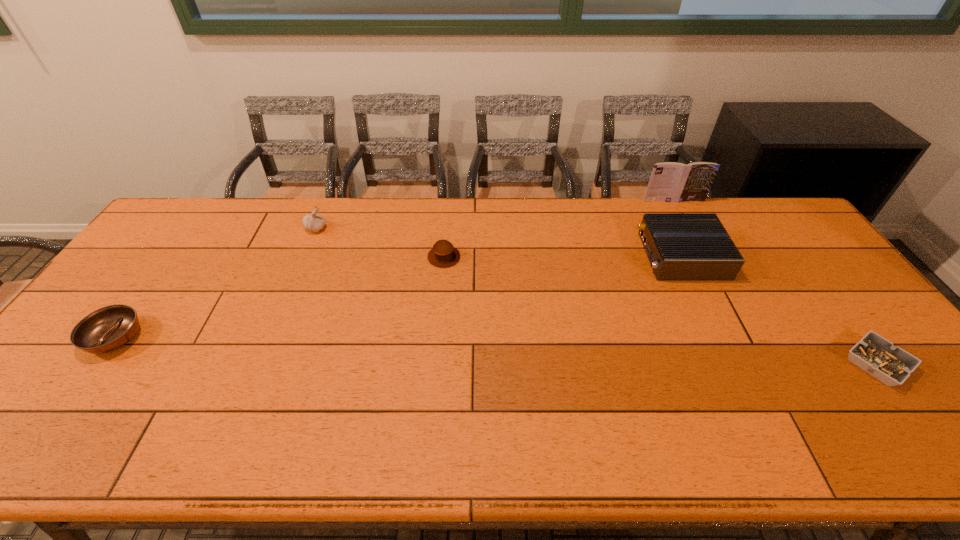
Find the location of a particular element. The width and height of the screenshot is (960, 540). object situated at the left edge is located at coordinates (106, 329).

Locate an element on the screen. object located in the right edge section of the desktop is located at coordinates (891, 365).

This screenshot has width=960, height=540. What are the coordinates of `free region at the far edge of the desktop` in the screenshot? It's located at (467, 210).

Where is `vacant position at the near edge of the desktop`? This screenshot has width=960, height=540. vacant position at the near edge of the desktop is located at coordinates (533, 429).

The height and width of the screenshot is (540, 960). In order to click on free space at the left edge of the desktop in this screenshot , I will do `click(60, 383)`.

In the image, there is a desktop. At what (x,y) coordinates should I click in order to perform the action: click on blank space at the right edge. Please return your answer as a coordinate pair (x, y). The height and width of the screenshot is (540, 960). Looking at the image, I should click on [x=901, y=407].

The width and height of the screenshot is (960, 540). I want to click on free space between the fifth tallest object and the shortest object, so click(x=495, y=351).

This screenshot has width=960, height=540. In order to click on free space between the fifth object from right to left and the router in this screenshot , I will do `click(499, 242)`.

Identify the location of vacant space that is in between the book and the ashtray. This screenshot has height=540, width=960. (775, 282).

Image resolution: width=960 pixels, height=540 pixels. Find the location of `vacant space that's between the farthest object and the soup bowl`. vacant space that's between the farthest object and the soup bowl is located at coordinates (394, 269).